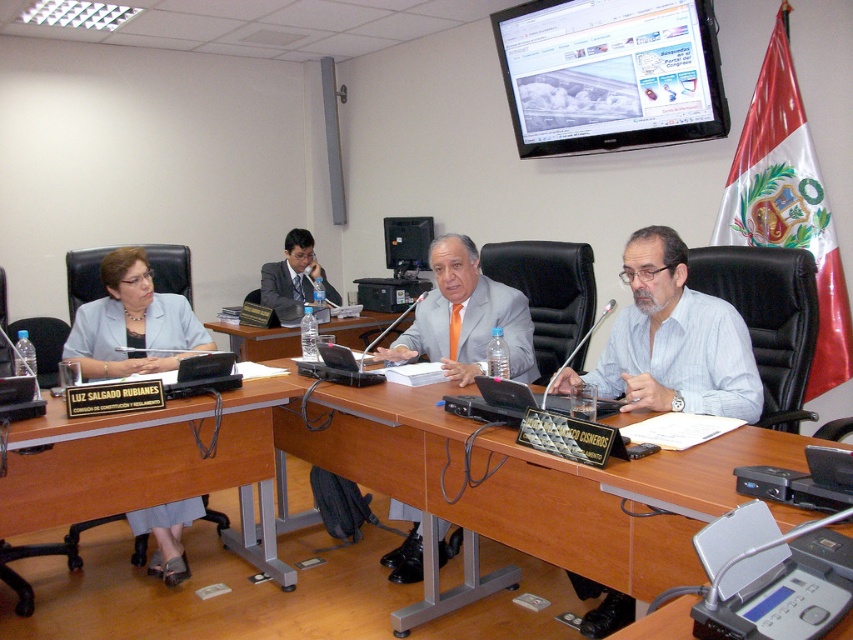
You are standing at the entrance of the conference room and want to locate the brown wood table at center. According to the coordinates provided, in which direction should you walk to reach it?

The brown wood table at center is located at coordinates point (521, 490). Since these coordinates are relative to the image frame, you should walk towards the center of the room to reach it.

You are sitting at the conference table in the image and need to reach both the point labeled as point (41, 492) and the point labeled as point (747, 413). Which point is closer to you when you are facing the large screen?

Point (747, 413) is closer to you because it is in front of point (41, 492), which is behind it.